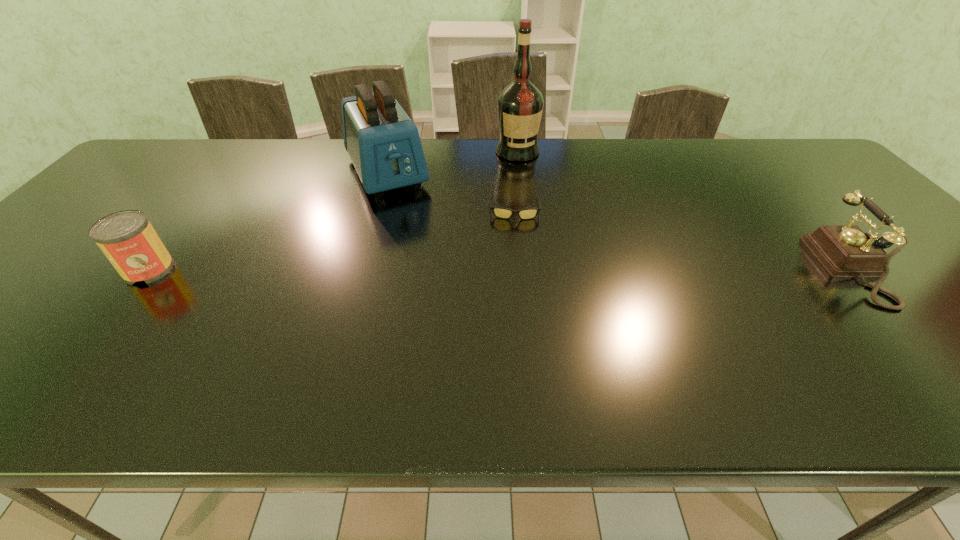
You are a GUI agent. You are given a task and a screenshot of the screen. Output one action in this format:
    pyautogui.click(x=<x>, y=<y>)
    Task: Click on the free spot on the desktop that is between the can and the rightmost object and is positioned on the front-facing side of the fourth shortest object
    The height and width of the screenshot is (540, 960).
    Given the screenshot: What is the action you would take?
    pyautogui.click(x=442, y=269)

This screenshot has width=960, height=540. What are the coordinates of `vacant space on the desktop that is between the can and the telephone and is positioned on the surface of the tallest object` in the screenshot? It's located at (570, 269).

In order to click on free space on the desktop that is between the leftmost object and the telephone and is positioned on the front-facing side of the sunglasses in this screenshot , I will do click(x=516, y=269).